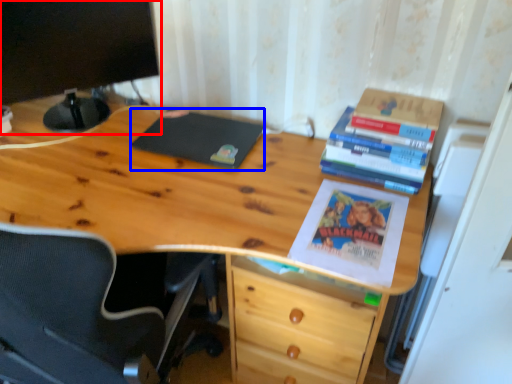
Question: Which object is closer to the camera taking this photo, computer monitor (highlighted by a red box) or notebook (highlighted by a blue box)?

Choices:
 (A) computer monitor
 (B) notebook

Answer: (A)